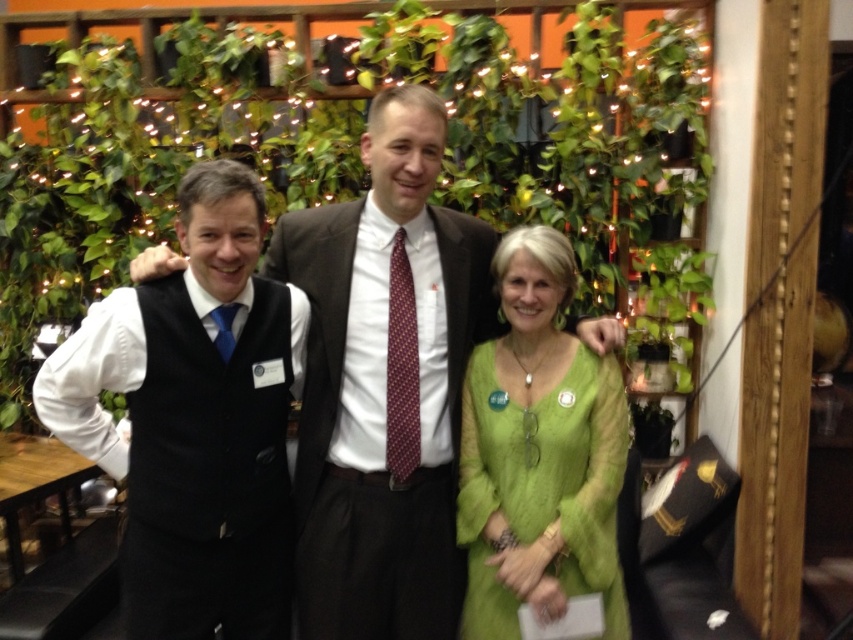
You are a photographer setting up for a group photo. You have a matte black vest at left and a green sheer dress at center in your viewfinder. Which clothing item appears taller in the frame?

The matte black vest at left appears taller than the green sheer dress at center in the frame.

You are a photographer setting up for a group photo. You need to ensure that the dark brown wool suit at center and the green sheer dress at center are both visible in the frame. Given their sizes, which one might require more space to accommodate in the composition?

The dark brown wool suit at center is larger in size than the green sheer dress at center, so it would require more space to accommodate in the composition.

You are a photographer adjusting the camera settings for a group photo. The camera has a focus range of 7 inches. You need to ensure that both the matte black vest at left and the green sheer dress at center are in focus. Can the camera focus on both objects simultaneously?

The matte black vest at left is 7.47 inches from the green sheer dress at center. Since the distance between them exceeds the camera focus range of 7 inches, the camera cannot focus on both objects simultaneously.